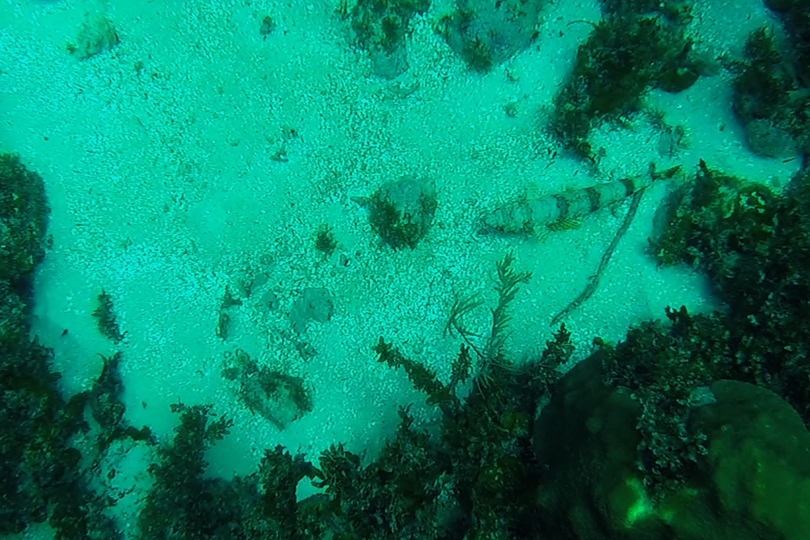
Find the location of a particular element. plant is located at coordinates (448, 325), (501, 299), (428, 374), (501, 409).